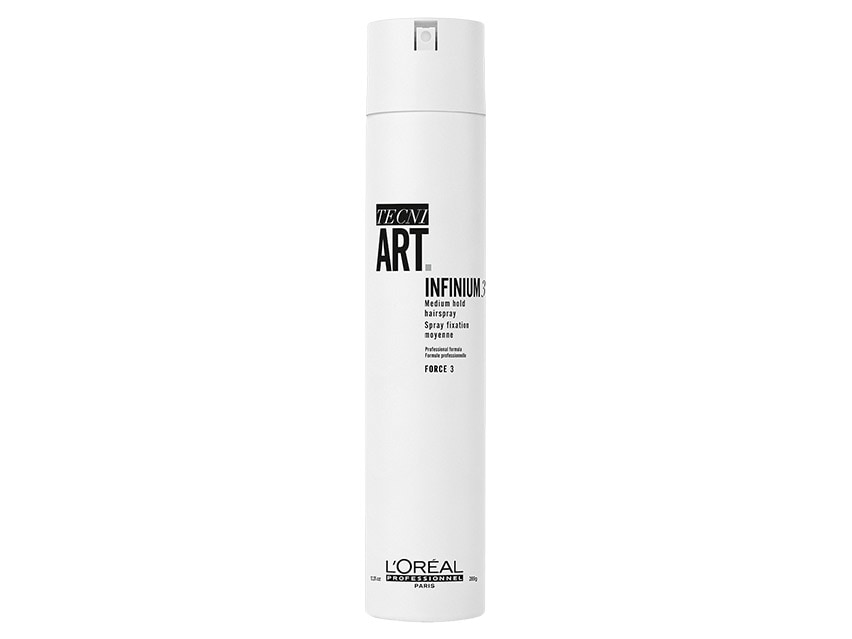
Image resolution: width=852 pixels, height=639 pixels. I want to click on cylindrical can, so click(x=406, y=479).